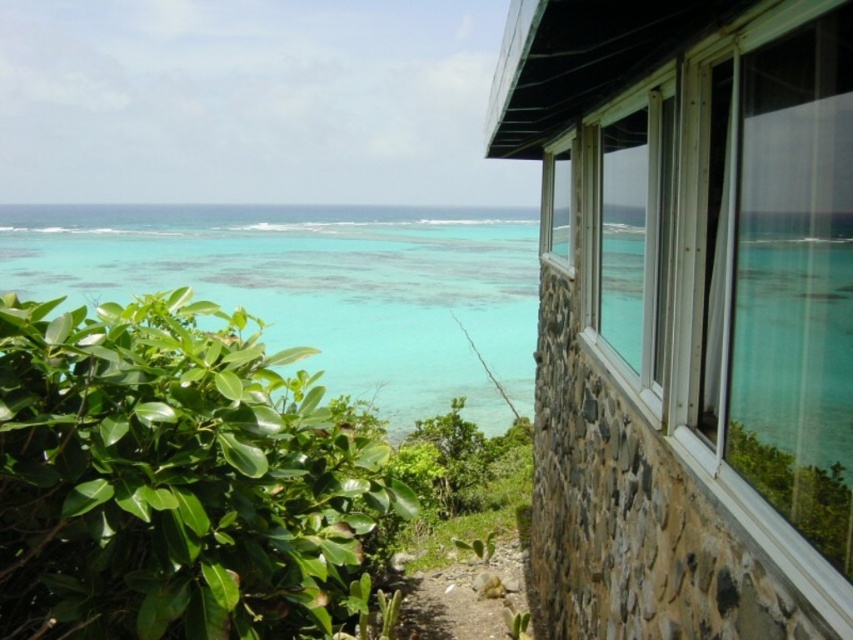
You are standing inside the stone building looking out the window. You see the translucent water at lower left and the green spiky cactus at lower center. Which object is positioned to the left of the other?

The translucent water at lower left is to the left of the green spiky cactus at lower center.

You are standing inside the stone building and want to look at the sea through the clear glass window at upper right. However, there is a green spiky cactus at lower center blocking your view. Can you move the cactus to the right side of the window to improve your view?

The green spiky cactus at lower center is currently to the left of the clear glass window at upper right. Moving it to the right side of the window would require placing it on the opposite side of its current position, which might not be feasible without obstructing other areas or the window itself. Consider rearranging the cactus carefully to avoid blocking the view.